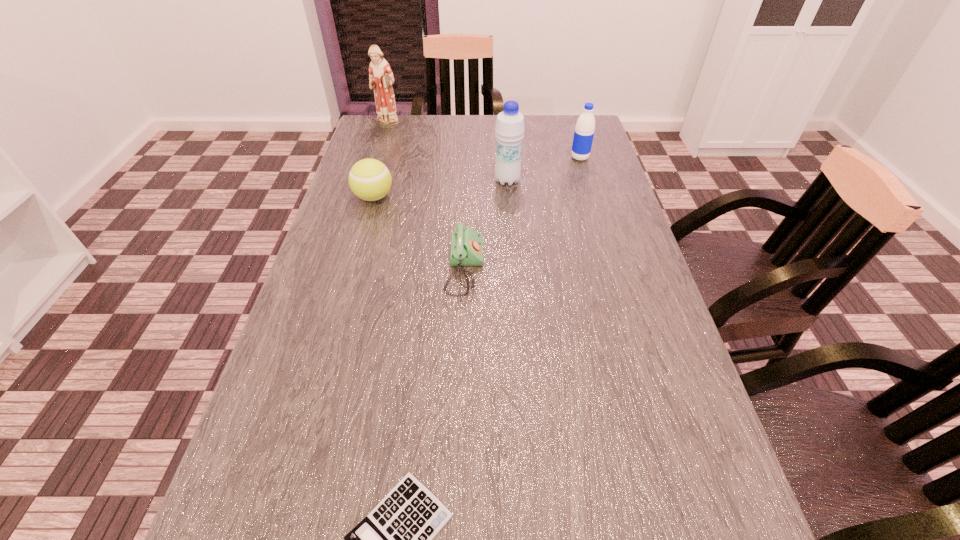
You are a GUI agent. You are given a task and a screenshot of the screen. Output one action in this format:
    pyautogui.click(x=<x>, y=<y>)
    Task: Click on the figurine
    This screenshot has width=960, height=540.
    Given the screenshot: What is the action you would take?
    pyautogui.click(x=381, y=78)

Locate an element on the screen. This screenshot has height=540, width=960. the left water bottle is located at coordinates pyautogui.click(x=509, y=130).

You are a GUI agent. You are given a task and a screenshot of the screen. Output one action in this format:
    pyautogui.click(x=<x>, y=<y>)
    Task: Click on the taller water bottle
    This screenshot has width=960, height=540.
    Given the screenshot: What is the action you would take?
    pyautogui.click(x=509, y=130)

The height and width of the screenshot is (540, 960). Identify the location of the rightmost object. (584, 131).

Identify the location of the farther water bottle. (584, 131).

What are the coordinates of `tennis ball` in the screenshot? It's located at (369, 179).

Locate an element on the screen. This screenshot has height=540, width=960. telephone is located at coordinates (466, 249).

This screenshot has height=540, width=960. Find the location of `the second nearest object`. the second nearest object is located at coordinates (466, 249).

Where is `vacant region located 0.100m on the front-facing side of the farthest object`? This screenshot has width=960, height=540. vacant region located 0.100m on the front-facing side of the farthest object is located at coordinates (381, 148).

What are the coordinates of `free spot located on the right of the fifth object from left to right` in the screenshot? It's located at (549, 180).